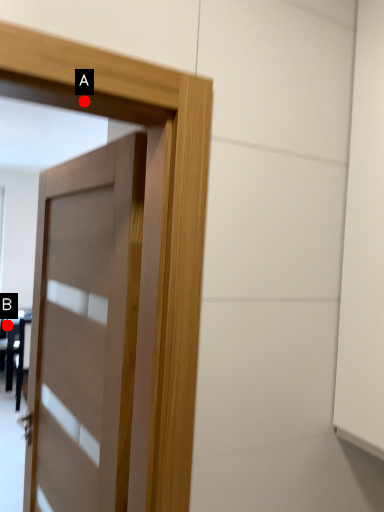
Question: Two points are circled on the image, labeled by A and B beside each circle. Which point is closer to the camera taking this photo?

Choices:
 (A) A is closer
 (B) B is closer

Answer: (A)